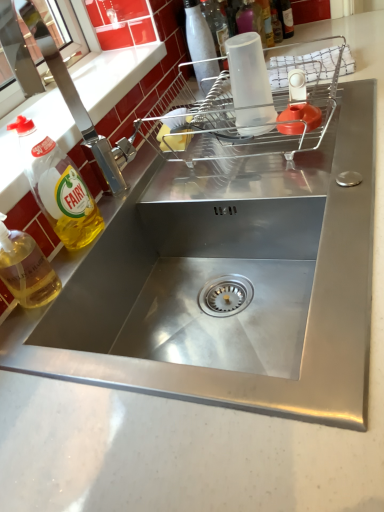
Question: Should I look upward or downward to see brushed metal tap at left?

Choices:
 (A) down
 (B) up

Answer: (B)

Question: Can you confirm if translucent plastic bottle at upper right, the 1th bottle from the right, is thinner than yellow translucent liquid at left, which appears as the 1th bottle when viewed from the front?

Choices:
 (A) no
 (B) yes

Answer: (B)

Question: Considering the relative sizes of translucent plastic bottle at upper right, arranged as the fifth bottle when viewed from the left, and yellow translucent liquid at left, acting as the 5th bottle starting from the top, in the image provided, is translucent plastic bottle at upper right, arranged as the fifth bottle when viewed from the left, smaller than yellow translucent liquid at left, acting as the 5th bottle starting from the top,?

Choices:
 (A) yes
 (B) no

Answer: (A)

Question: From a real-world perspective, is translucent plastic bottle at upper right, arranged as the fifth bottle when viewed from the left, physically below yellow translucent liquid at left, the 1th bottle from the bottom?

Choices:
 (A) yes
 (B) no

Answer: (B)

Question: From the image's perspective, would you say translucent plastic bottle at upper right, which is the 5th bottle in front-to-back order, is positioned over yellow translucent liquid at left, acting as the 5th bottle starting from the top?

Choices:
 (A) yes
 (B) no

Answer: (A)

Question: From the image's perspective, does translucent plastic bottle at upper right, which is the 5th bottle in front-to-back order, appear lower than yellow translucent liquid at left, which appears as the 1th bottle when viewed from the front?

Choices:
 (A) yes
 (B) no

Answer: (B)

Question: Is translucent plastic bottle at upper right, arranged as the first bottle when viewed from the top, facing towards yellow translucent liquid at left, the 1th bottle from the bottom?

Choices:
 (A) no
 (B) yes

Answer: (A)

Question: Does clear plastic dish rack at upper center have a lesser width compared to white glossy bottle at upper center, which appears as the third bottle when viewed from the front?

Choices:
 (A) no
 (B) yes

Answer: (A)

Question: Could you tell me if clear plastic dish rack at upper center is facing white glossy bottle at upper center, the third bottle positioned from the left?

Choices:
 (A) yes
 (B) no

Answer: (B)

Question: Is clear plastic dish rack at upper center turned away from white glossy bottle at upper center, placed as the 3th bottle when sorted from bottom to top?

Choices:
 (A) no
 (B) yes

Answer: (A)

Question: From a real-world perspective, is clear plastic dish rack at upper center under white glossy bottle at upper center, the third bottle positioned from the top?

Choices:
 (A) no
 (B) yes

Answer: (B)

Question: Is clear plastic dish rack at upper center behind white glossy bottle at upper center, which appears as the third bottle when viewed from the front?

Choices:
 (A) no
 (B) yes

Answer: (A)

Question: Does clear plastic dish rack at upper center touch white glossy bottle at upper center, the 3th bottle in the back-to-front sequence?

Choices:
 (A) no
 (B) yes

Answer: (A)

Question: From a real-world perspective, is white glossy bottle at upper center, the 3th bottle viewed from the right, under yellow translucent liquid at left, the 1th bottle from the bottom?

Choices:
 (A) no
 (B) yes

Answer: (A)